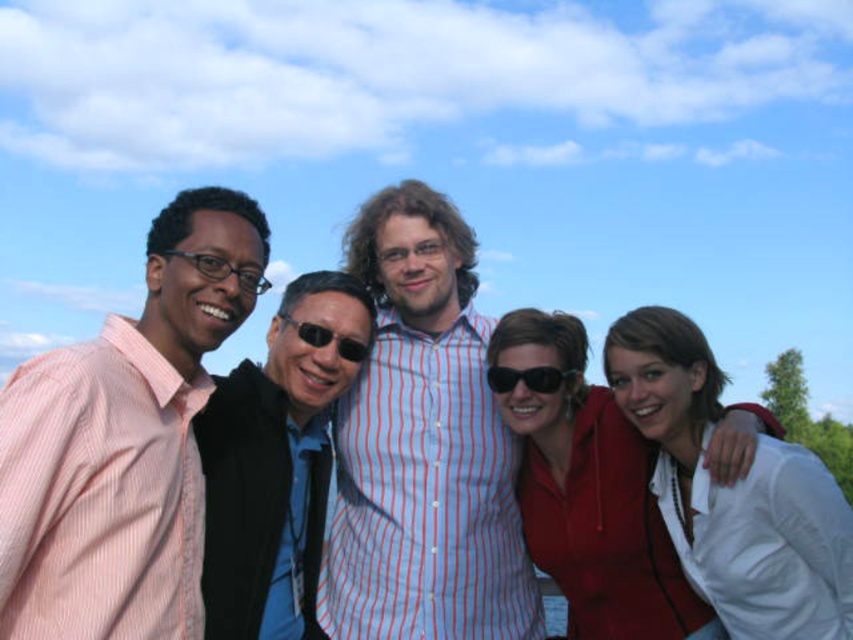
In the scene shown: Please provide the 2D coordinates of the striped cotton shirt at center in the image. The answer should be in the format of coordinates enclosed in parentheses, like so, for example, if the coordinates were 0.5, 0.5, it would be written as follows. Answer with the exact value given in the Objects Description. The question must mention all objects from the Objects list. The answer must use the exact coordinates from the Objects Description. Please strictly follow the format. Please do not add any extra ver

The striped cotton shirt at center is located at coordinates (422,445).

You are a photographer standing in front of the group. You want to take a photo that includes both the striped cotton shirt at center and the white matte jacket at center. Which one should you focus on first to ensure both are in focus?

You should focus on the striped cotton shirt at center first because it is closer to you than the white matte jacket at center, so adjusting focus from near to far will help both be in focus.